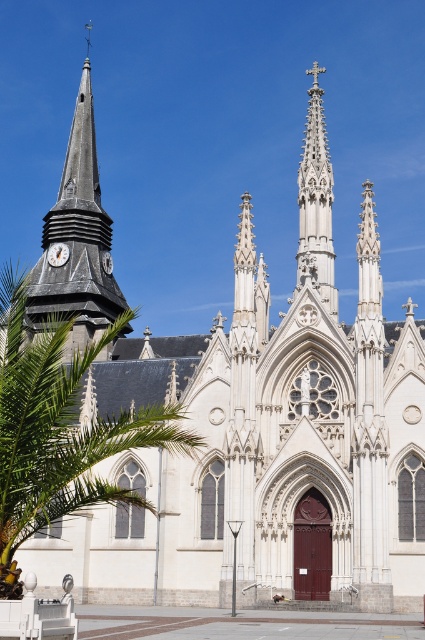
Is green leafy palm tree at left wider than dark gray stone steeple at left?

Indeed, green leafy palm tree at left has a greater width compared to dark gray stone steeple at left.

Which is more to the left, green leafy palm tree at left or dark gray stone steeple at left?

dark gray stone steeple at left is more to the left.

Between point (0, 358) and point (28, 324), which one is positioned behind?

The point (28, 324) is more distant.

Image resolution: width=425 pixels, height=640 pixels. I want to click on green leafy palm tree at left, so click(x=59, y=428).

Does white stone spire at center have a larger size compared to matte black clock at upper left?

Yes.

Is white stone spire at center in front of matte black clock at upper left?

Yes.

Does point (317, 248) come in front of point (53, 264)?

Yes.

Identify the location of white stone spire at center. (316, 202).

Can you confirm if green leafy palm tree at left is thinner than matte black clock at upper left?

In fact, green leafy palm tree at left might be wider than matte black clock at upper left.

Who is more distant from viewer, (x=14, y=426) or (x=61, y=252)?

The point (x=61, y=252) is behind.

Between point (73, 394) and point (48, 250), which one is positioned behind?

Point (48, 250)

The image size is (425, 640). I want to click on green leafy palm tree at left, so tap(59, 428).